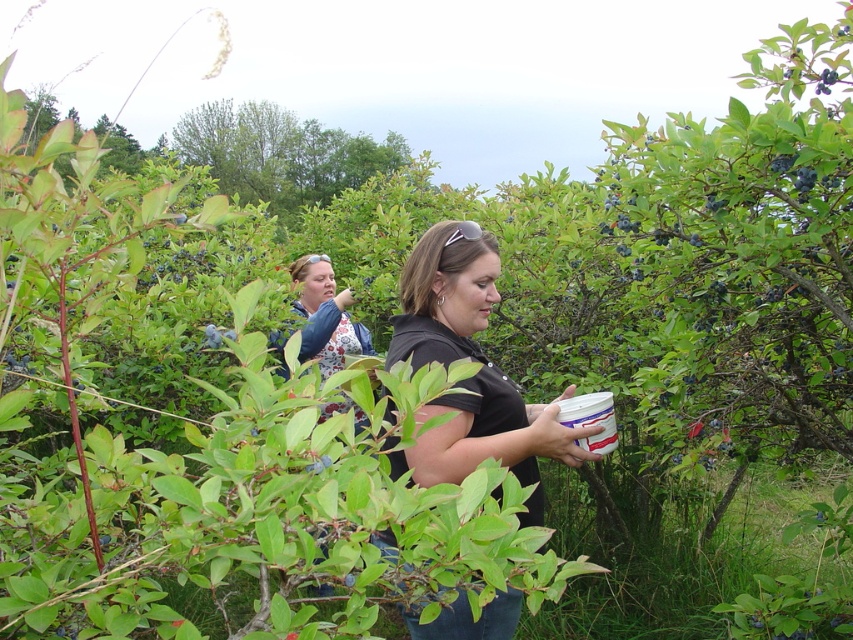
Does matte black shirt at center have a lesser width compared to floral-patterned shirt at center?

In fact, matte black shirt at center might be wider than floral-patterned shirt at center.

Can you confirm if matte black shirt at center is smaller than floral-patterned shirt at center?

No, matte black shirt at center is not smaller than floral-patterned shirt at center.

Is point (466, 435) in front of point (318, 275)?

Yes, it is in front of point (318, 275).

Where is `matte black shirt at center`? The image size is (853, 640). matte black shirt at center is located at coordinates (469, 358).